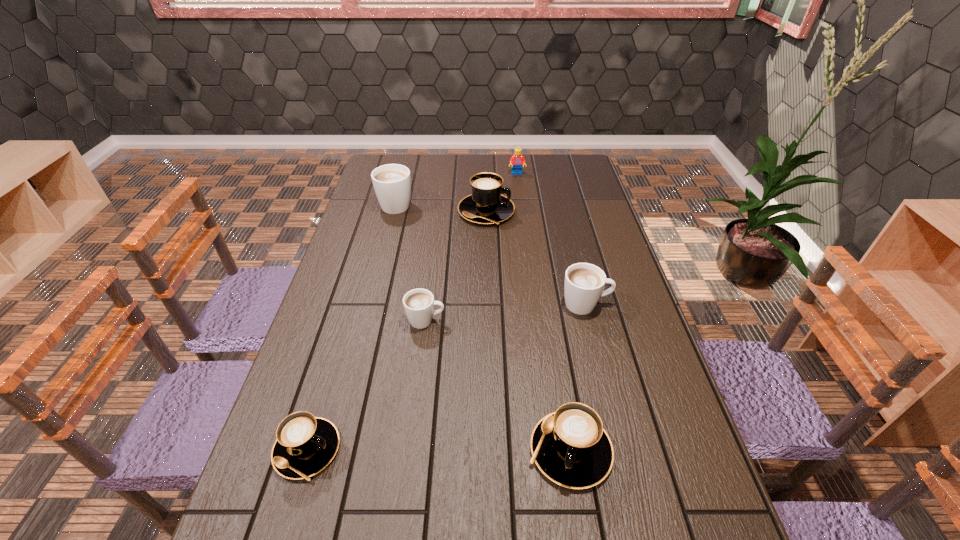
You are a GUI agent. You are given a task and a screenshot of the screen. Output one action in this format:
    pyautogui.click(x=<x>, y=<y>)
    Task: Click on the farthest white cappuccino
    
    Given the screenshot: What is the action you would take?
    pyautogui.click(x=392, y=182)

Image resolution: width=960 pixels, height=540 pixels. In order to click on the leftmost white cappuccino in this screenshot , I will do `click(392, 182)`.

The image size is (960, 540). Find the location of `the farthest black cappuccino`. the farthest black cappuccino is located at coordinates (486, 205).

The image size is (960, 540). What are the coordinates of `Lego` in the screenshot? It's located at (517, 160).

The width and height of the screenshot is (960, 540). I want to click on the second smallest white cappuccino, so click(584, 283).

Find the location of a particular element. This screenshot has width=960, height=540. the second biggest black cappuccino is located at coordinates (570, 446).

The width and height of the screenshot is (960, 540). I want to click on the leftmost black cappuccino, so click(305, 445).

Locate an element on the screen. This screenshot has height=540, width=960. the third object from left to right is located at coordinates (418, 304).

What are the coordinates of `the smallest white cappuccino` in the screenshot? It's located at (418, 304).

Locate an element on the screen. The height and width of the screenshot is (540, 960). blank space located 0.170m with the handle on the side of the leftmost white cappuccino is located at coordinates (x=405, y=170).